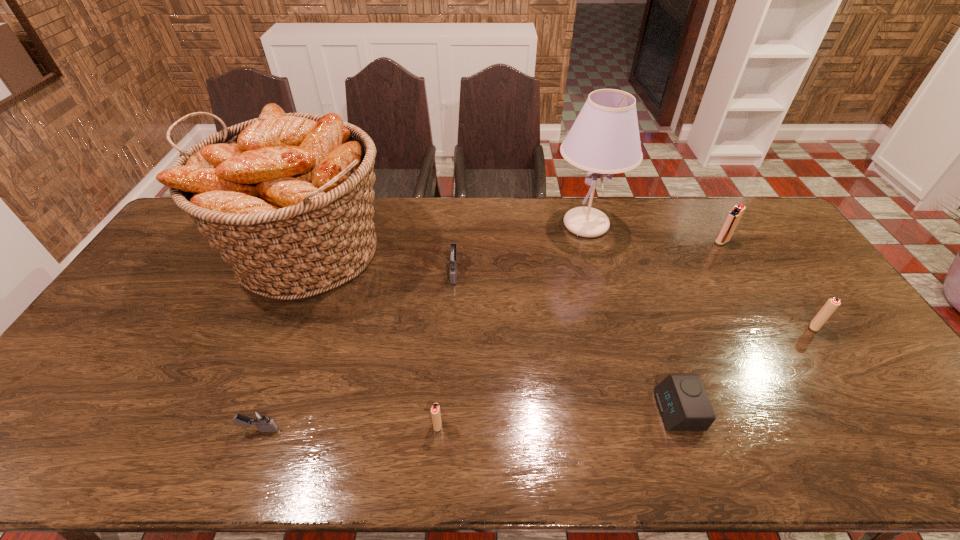
This screenshot has width=960, height=540. What are the coordinates of `vacant space positioned 0.340m on the left of the left gray igniter` in the screenshot? It's located at (97, 429).

Where is `free space located 0.400m on the front-facing side of the alarm clock`? free space located 0.400m on the front-facing side of the alarm clock is located at coordinates (494, 410).

In order to click on vacant space located 0.150m on the front-facing side of the alarm clock in this screenshot , I will do `click(597, 410)`.

The width and height of the screenshot is (960, 540). What are the coordinates of `blank space located on the front-facing side of the alarm clock` in the screenshot? It's located at (593, 410).

This screenshot has height=540, width=960. Find the location of `lampshade that is at the far edge`. lampshade that is at the far edge is located at coordinates (604, 139).

Locate an element on the screen. The height and width of the screenshot is (540, 960). basket present at the far edge is located at coordinates (286, 199).

Find the location of `igniter located in the far edge section of the desktop`. igniter located in the far edge section of the desktop is located at coordinates (733, 217).

This screenshot has height=540, width=960. I want to click on alarm clock that is at the near edge, so click(x=682, y=400).

Locate an element on the screen. The width and height of the screenshot is (960, 540). object positioned at the right edge is located at coordinates [x=832, y=304].

At what (x,y) coordinates should I click in order to perform the action: click on free space at the far edge of the desktop. Please return your answer as a coordinate pair (x, y). The image size is (960, 540). Looking at the image, I should click on (624, 215).